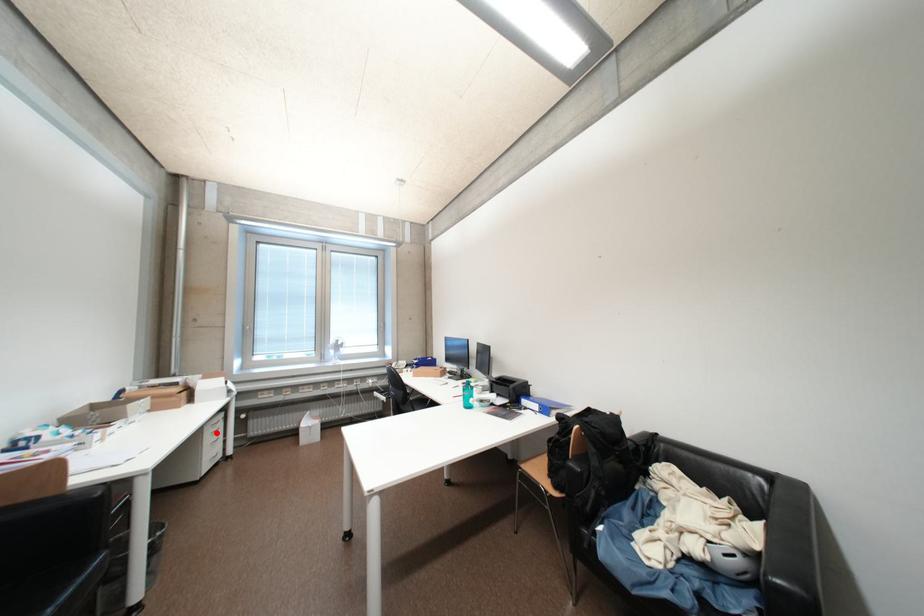
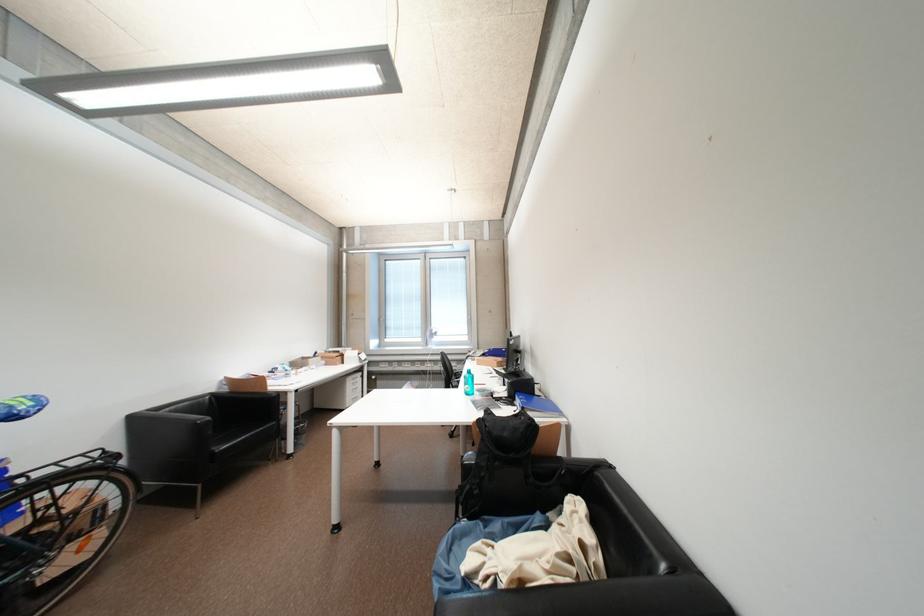
Question: I am providing you with two images of the same scene from different viewpoints. A red point is shown in image1. For the corresponding object point in image2, is it positioned nearer or farther from the camera?

Choices:
 (A) Nearer
 (B) Farther

Answer: (B)